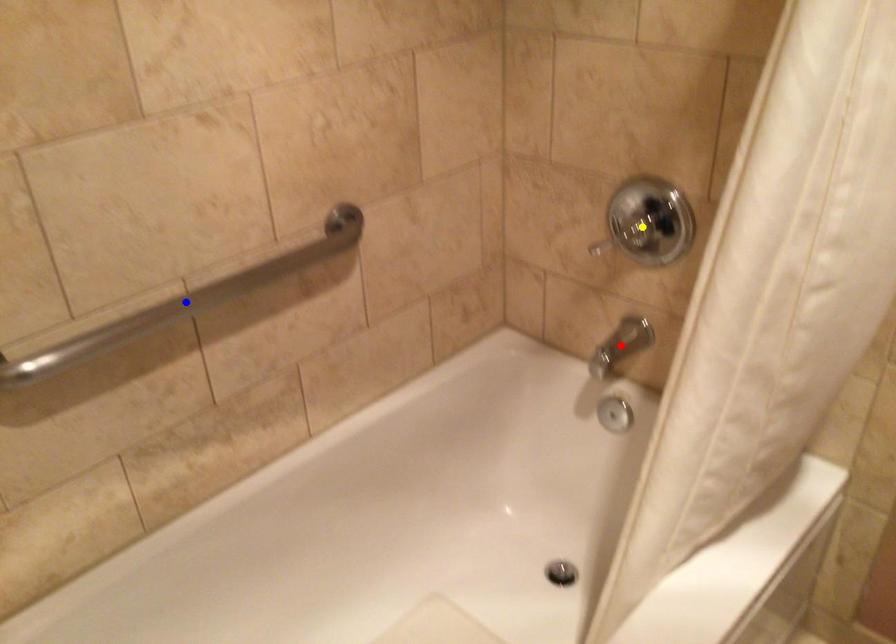
Order these from nearest to farthest:
yellow point, blue point, red point

red point → yellow point → blue point